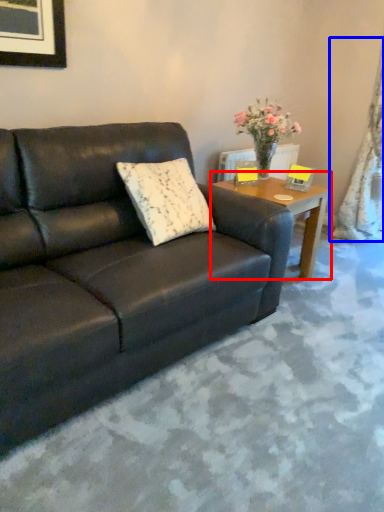
Question: Which point is further to the camera, coffee table (highlighted by a red box) or curtain (highlighted by a blue box)?

Choices:
 (A) coffee table
 (B) curtain

Answer: (B)